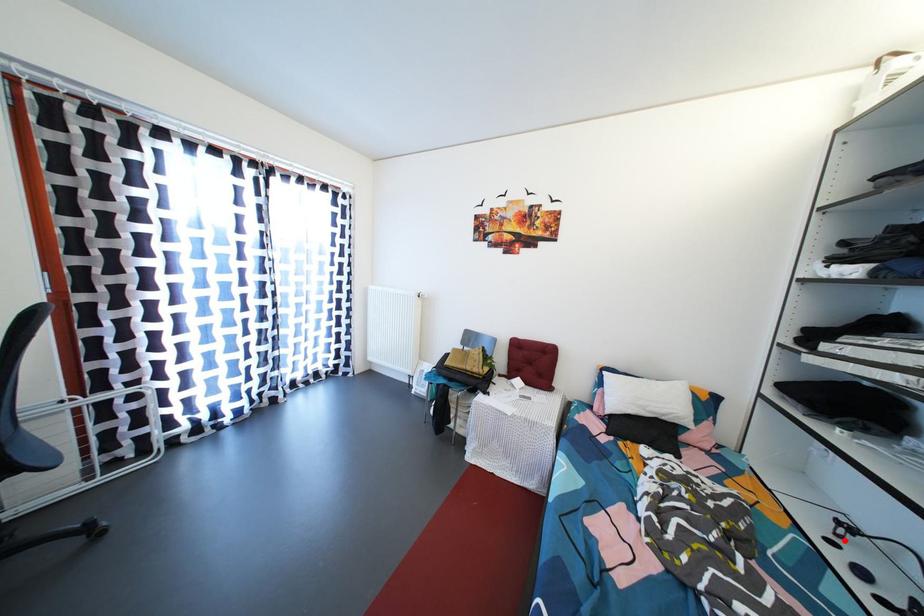
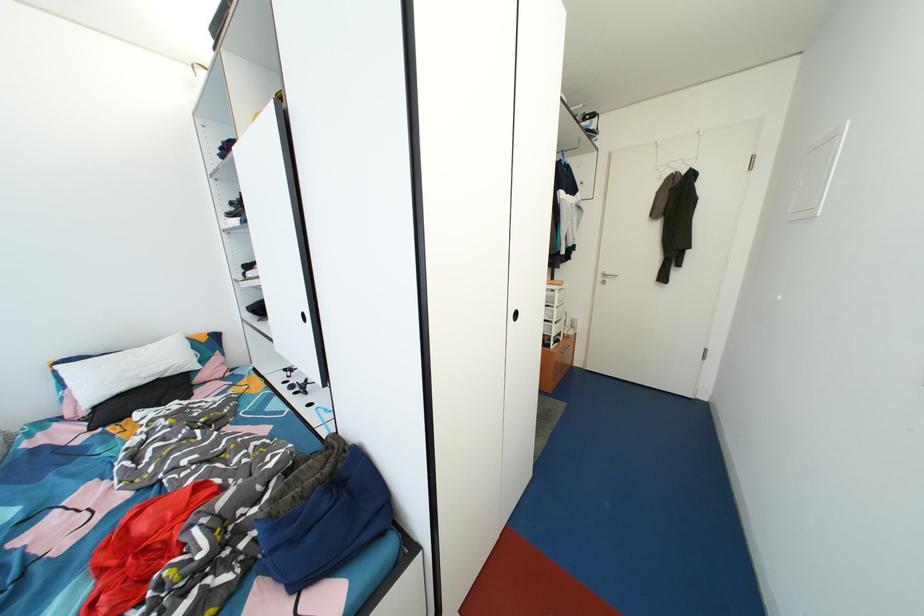
In the second image, find the point that corresponds to the highlighted location in the first image.

(295, 382)